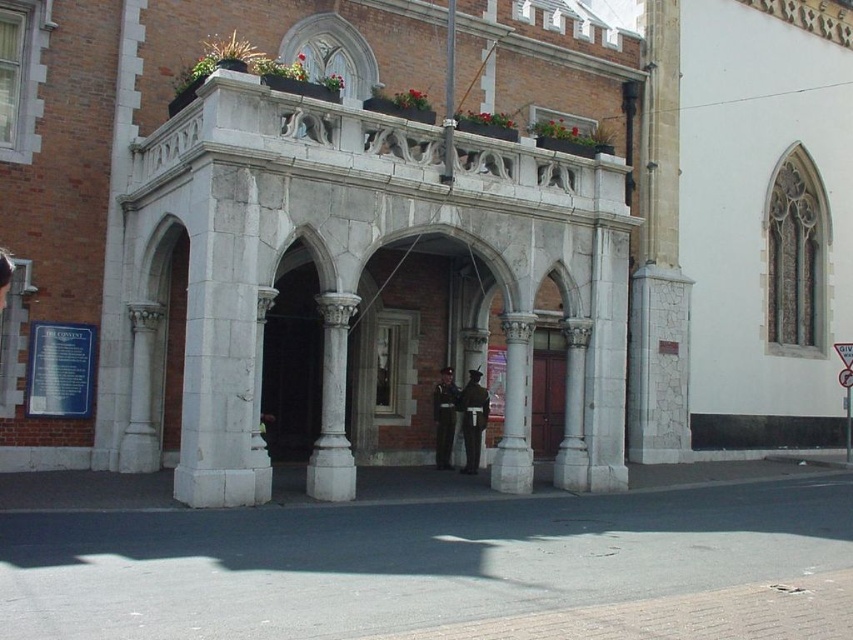
Is white marble column at center positioned in front of brown wooden door at center?

Yes.

Is point (321, 496) positioned behind point (546, 388)?

No, it is not.

Which is in front, point (329, 460) or point (544, 401)?

Positioned in front is point (329, 460).

I want to click on white marble column at center, so click(332, 404).

Does white marble column at center appear under metallic rectangular sign at center?

Yes, white marble column at center is below metallic rectangular sign at center.

Who is more distant from viewer, [347,461] or [850,458]?

The point [850,458] is behind.

Where is `white marble column at center`? This screenshot has width=853, height=640. white marble column at center is located at coordinates 332,404.

This screenshot has height=640, width=853. In order to click on brown wooden door at center in this screenshot , I will do `click(547, 401)`.